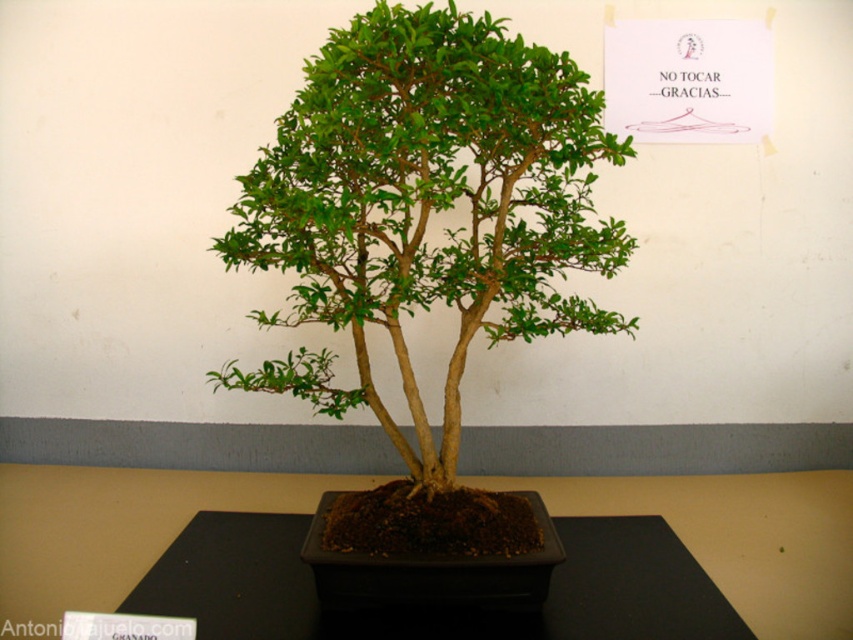
Question: Is green matte bonsai tree at center positioned in front of black matte table at center?

Choices:
 (A) yes
 (B) no

Answer: (A)

Question: Which of the following is the closest to the observer?

Choices:
 (A) black matte table at center
 (B) green matte bonsai tree at center

Answer: (B)

Question: Among these objects, which one is farthest from the camera?

Choices:
 (A) green matte bonsai tree at center
 (B) black matte table at center

Answer: (B)

Question: Which point is closer to the camera?

Choices:
 (A) black matte table at center
 (B) green matte bonsai tree at center

Answer: (B)

Question: Can you confirm if green matte bonsai tree at center is positioned to the right of black matte table at center?

Choices:
 (A) yes
 (B) no

Answer: (B)

Question: Does green matte bonsai tree at center have a greater width compared to black matte table at center?

Choices:
 (A) yes
 (B) no

Answer: (B)